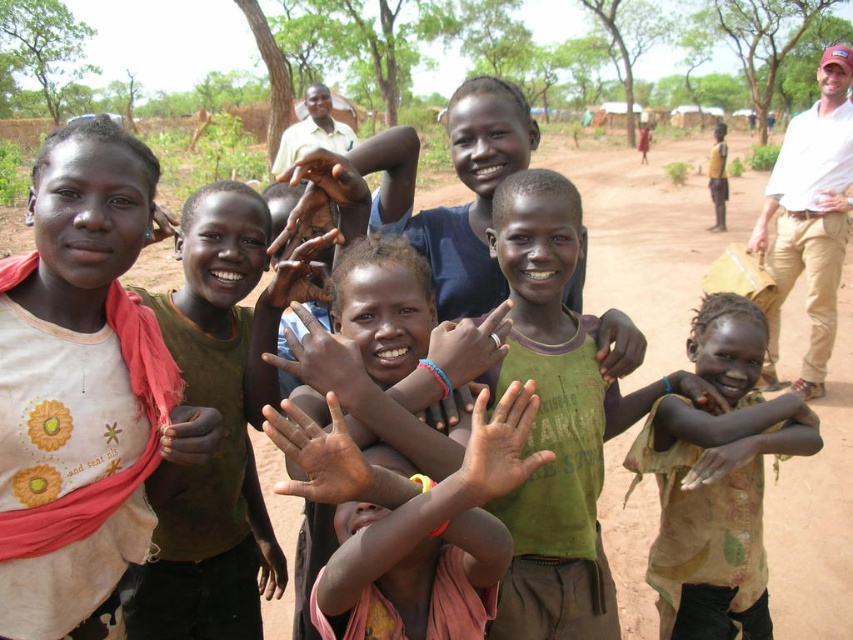
Between green fabric shirt at center and green cotton shirt at center, which one appears on the right side from the viewer's perspective?

green cotton shirt at center is more to the right.

Which is behind, point (196, 604) or point (490, 388)?

The point (196, 604) is behind.

Image resolution: width=853 pixels, height=640 pixels. I want to click on green fabric shirt at center, so click(x=223, y=424).

Who is taller, green cotton shirt at center or matte green hand at center?

Standing taller between the two is green cotton shirt at center.

Is green cotton shirt at center behind matte green hand at center?

No, it is in front of matte green hand at center.

In order to click on green cotton shirt at center in this screenshot , I will do `click(558, 419)`.

Is matte white shirt at left shorter than matte green hand at center?

No, matte white shirt at left is not shorter than matte green hand at center.

Consider the image. Does matte white shirt at left appear over matte green hand at center?

No.

This screenshot has height=640, width=853. Describe the element at coordinates (82, 390) in the screenshot. I see `matte white shirt at left` at that location.

Identify the location of matte white shirt at left. The image size is (853, 640). (82, 390).